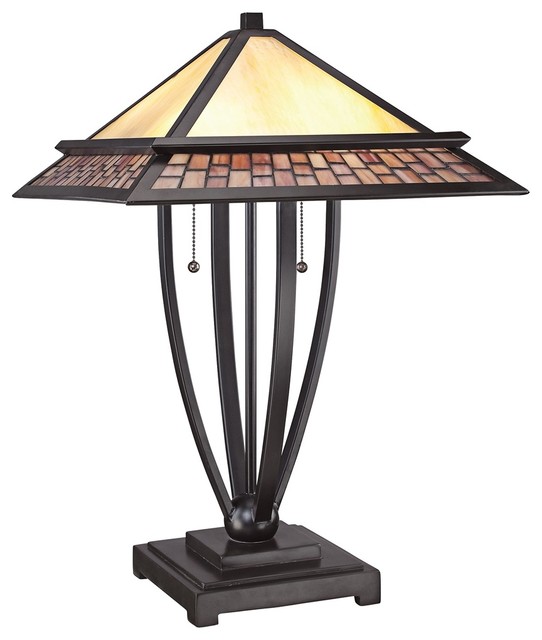
Find the location of `cord`. cord is located at coordinates (191, 242), (303, 253).